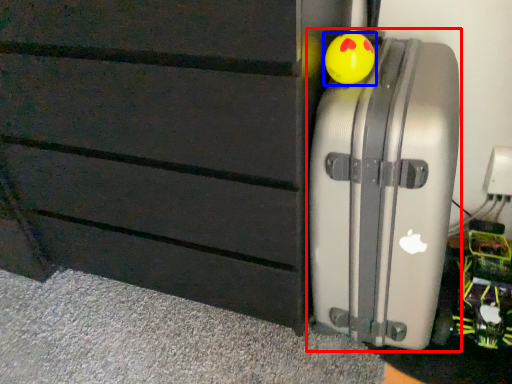
Question: Which of the following is the closest to the observer, suitcase (highlighted by a red box) or toy (highlighted by a blue box)?

Choices:
 (A) suitcase
 (B) toy

Answer: (A)